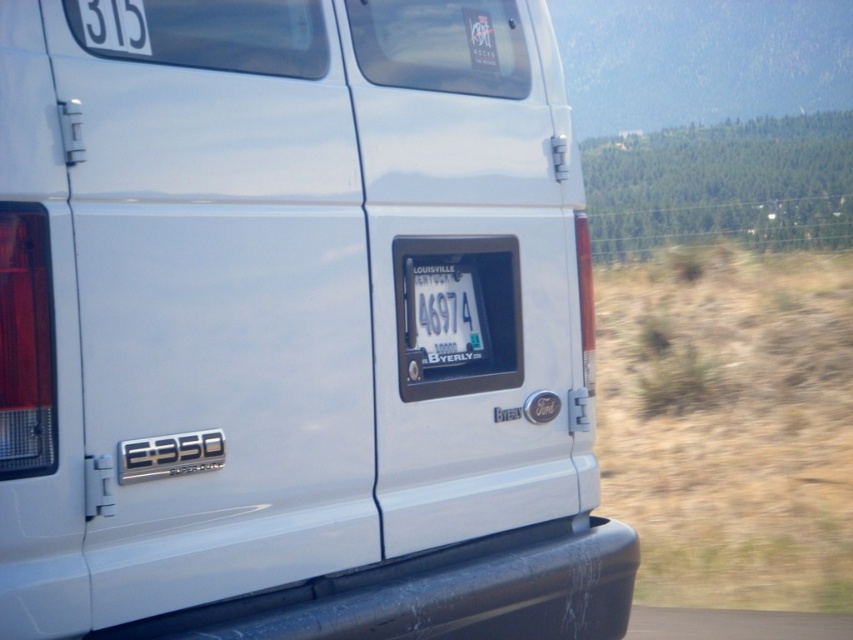
Question: Can you confirm if black rubber bumper at lower center is thinner than white plastic license plate at center?

Choices:
 (A) yes
 (B) no

Answer: (B)

Question: Which point is farther from the camera taking this photo?

Choices:
 (A) (457, 344)
 (B) (322, 604)

Answer: (A)

Question: Is black rubber bumper at lower center closer to camera compared to white plastic license plate at center?

Choices:
 (A) yes
 (B) no

Answer: (A)

Question: Which object appears closest to the camera in this image?

Choices:
 (A) white plastic license plate at center
 (B) black rubber bumper at lower center

Answer: (B)

Question: Which point is closer to the camera?

Choices:
 (A) white plastic license plate at center
 (B) black rubber bumper at lower center

Answer: (B)

Question: Does black rubber bumper at lower center lie behind white plastic license plate at center?

Choices:
 (A) no
 (B) yes

Answer: (A)